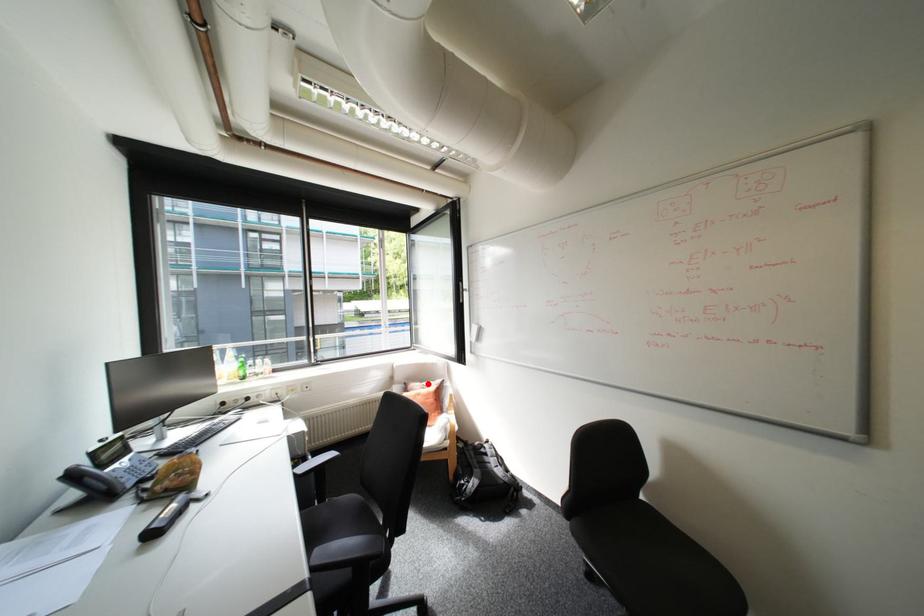
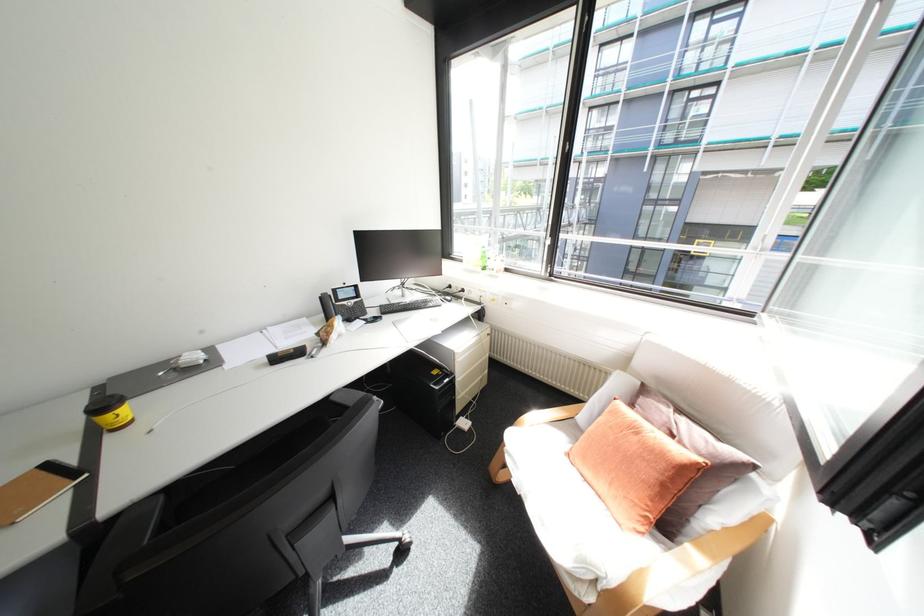
In the second image, find the point that corresponds to the highlighted location in the first image.

(677, 410)